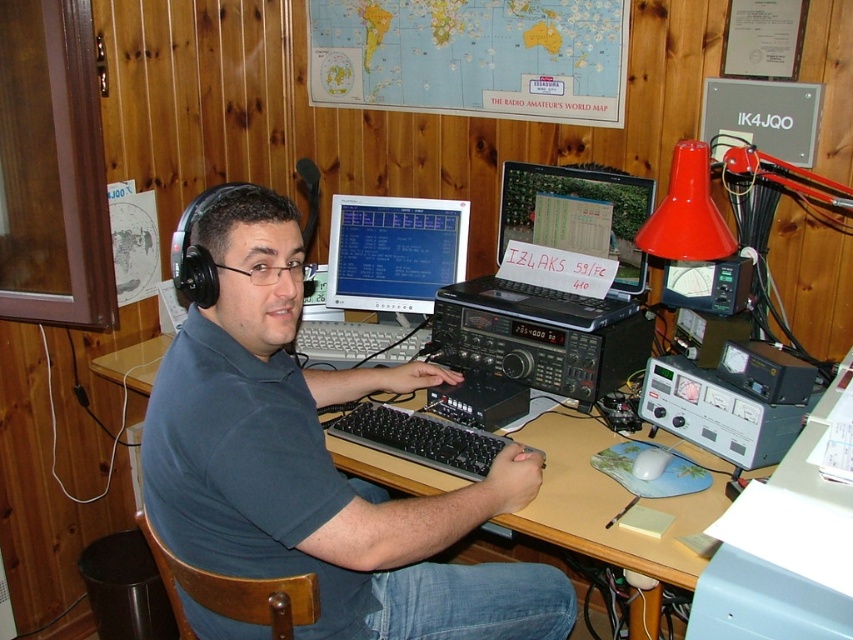
You are organizing a radio amateur event and need to place a name tag on the dark blue shirt at center and a device manual next to the matte black laptop at center. According to the scene, where should you place the name tag relative to the laptop?

The dark blue shirt at center is to the left of the matte black laptop at center, so place the name tag to the left of the laptop.

You are setting up a new desk arrangement and want to place a decorative item between the matte plastic monitor at center and the black plastic keyboard at center. Which object should the decorative item be placed closer to if the goal is to balance the visual weight based on their sizes?

The matte plastic monitor at center is much taller than the black plastic keyboard at center, so the decorative item should be placed closer to the keyboard to balance the visual weight.

You are a visitor in the room and want to take a photo of the dark blue shirt at center and the matte black laptop at center. Which object will appear larger in your photo?

The dark blue shirt at center will appear larger in the photo because it is closer to the viewer than the matte black laptop at center.